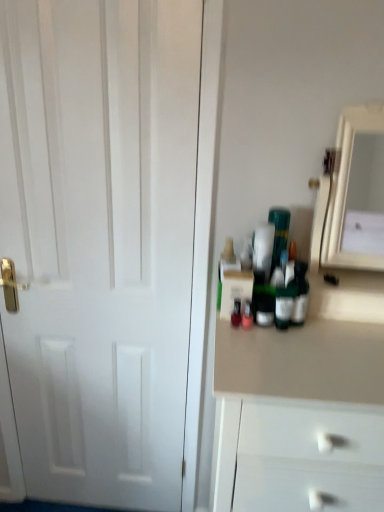
Question: Can you confirm if white glossy medicine cabinet at right is shorter than white matte door at left?

Choices:
 (A) yes
 (B) no

Answer: (A)

Question: From a real-world perspective, is white glossy medicine cabinet at right under white matte door at left?

Choices:
 (A) yes
 (B) no

Answer: (B)

Question: Is white glossy medicine cabinet at right completely or partially outside of white matte door at left?

Choices:
 (A) yes
 (B) no

Answer: (A)

Question: Is white matte door at left at the back of white glossy medicine cabinet at right?

Choices:
 (A) yes
 (B) no

Answer: (B)

Question: Can you confirm if white glossy medicine cabinet at right is thinner than white matte door at left?

Choices:
 (A) no
 (B) yes

Answer: (A)

Question: Is white glossy medicine cabinet at right far away from white matte door at left?

Choices:
 (A) no
 (B) yes

Answer: (B)

Question: Is white matte door at left positioned beyond the bounds of white glossy medicine cabinet at right?

Choices:
 (A) no
 (B) yes

Answer: (B)

Question: From the image's perspective, is white matte door at left beneath white glossy medicine cabinet at right?

Choices:
 (A) yes
 (B) no

Answer: (A)

Question: Can you confirm if white matte door at left is smaller than white glossy medicine cabinet at right?

Choices:
 (A) yes
 (B) no

Answer: (B)

Question: From a real-world perspective, is white matte door at left over white glossy medicine cabinet at right?

Choices:
 (A) no
 (B) yes

Answer: (A)

Question: Considering the relative sizes of white matte door at left and white glossy medicine cabinet at right in the image provided, is white matte door at left thinner than white glossy medicine cabinet at right?

Choices:
 (A) no
 (B) yes

Answer: (B)

Question: Is white matte door at left positioned behind white glossy medicine cabinet at right?

Choices:
 (A) no
 (B) yes

Answer: (B)

Question: Is point (77, 217) positioned closer to the camera than point (355, 197)?

Choices:
 (A) farther
 (B) closer

Answer: (B)